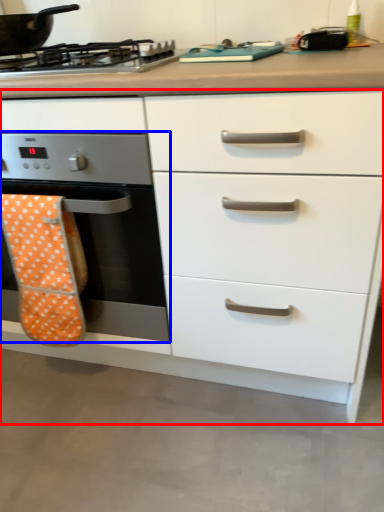
Question: Which of the following is the closest to the observer, chest of drawers (highlighted by a red box) or home appliance (highlighted by a blue box)?

Choices:
 (A) chest of drawers
 (B) home appliance

Answer: (A)